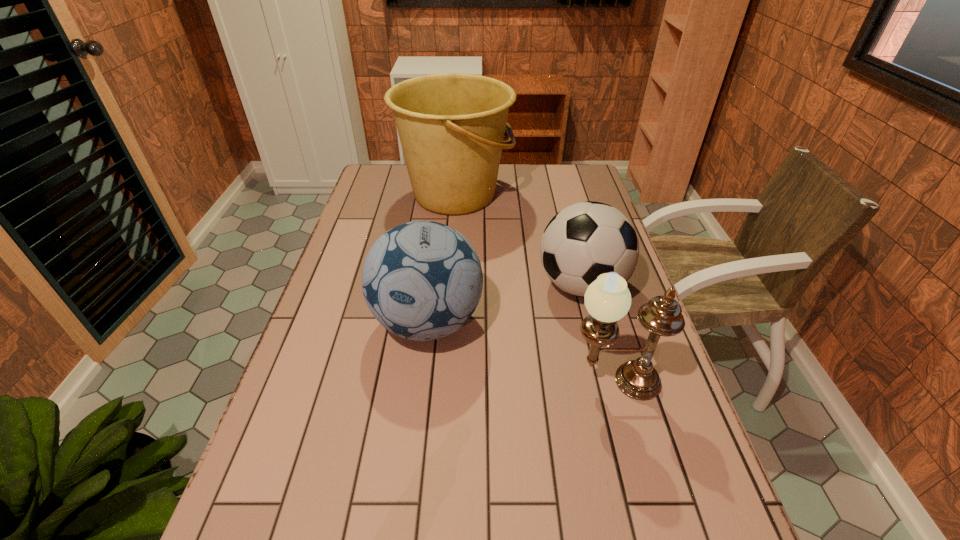
Find the location of `soccer ball present at the left edge`. soccer ball present at the left edge is located at coordinates (422, 280).

Locate an element on the screen. oil lamp that is at the right edge is located at coordinates (607, 299).

Identify the location of soccer ball that is positioned at the right edge. 584,240.

Identify the location of object at the far left corner. (451, 126).

Where is `blank area at the far edge`? blank area at the far edge is located at coordinates (538, 190).

This screenshot has height=540, width=960. I want to click on vacant space at the left edge, so click(381, 219).

What are the coordinates of `vacant region at the right edge of the desktop` in the screenshot? It's located at coord(612,362).

At what (x,y) coordinates should I click in order to perform the action: click on vacant region at the far left corner of the desktop. Please return your answer as a coordinate pair (x, y). The height and width of the screenshot is (540, 960). Looking at the image, I should click on (377, 171).

This screenshot has width=960, height=540. What are the coordinates of `vacant space that is in between the right soccer ball and the bucket` in the screenshot? It's located at (518, 240).

Image resolution: width=960 pixels, height=540 pixels. Find the location of `vacant area that lies between the right soccer ball and the farthest object`. vacant area that lies between the right soccer ball and the farthest object is located at coordinates (518, 240).